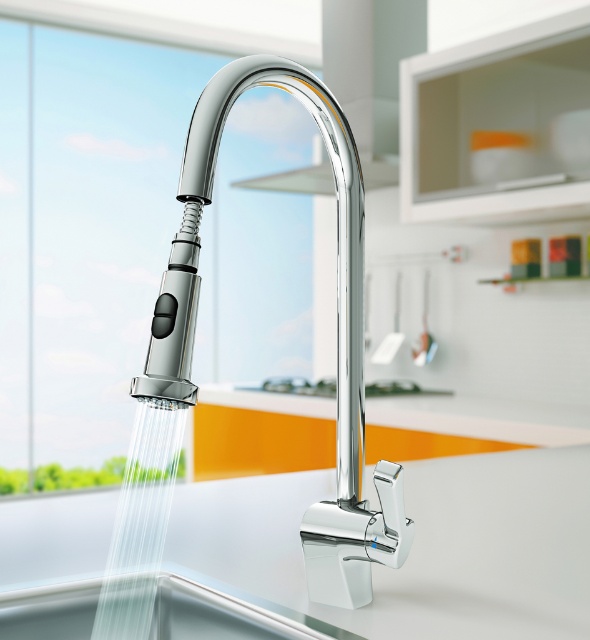
Question: Which object is the closest to the chrome/metallic faucet at center?

Choices:
 (A) clear liquid water at lower left
 (B) chrome/polished metal sink at center

Answer: (A)

Question: Is chrome/polished metal sink at center closer to camera compared to clear liquid water at lower left?

Choices:
 (A) yes
 (B) no

Answer: (B)

Question: From the image, what is the correct spatial relationship of chrome/polished metal sink at center in relation to clear liquid water at lower left?

Choices:
 (A) below
 (B) above

Answer: (A)

Question: Which object is the farthest from the chrome/polished metal sink at center?

Choices:
 (A) clear liquid water at lower left
 (B) chrome/metallic faucet at center

Answer: (B)

Question: Which of these objects is positioned farthest from the chrome/polished metal sink at center?

Choices:
 (A) clear liquid water at lower left
 (B) chrome/metallic faucet at center

Answer: (B)

Question: Can you confirm if chrome/metallic faucet at center is positioned above clear liquid water at lower left?

Choices:
 (A) yes
 (B) no

Answer: (A)